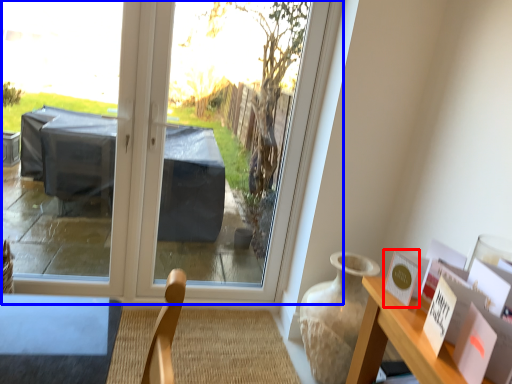
Question: Which point is further to the camera, postcard (highlighted by a red box) or window (highlighted by a blue box)?

Choices:
 (A) postcard
 (B) window

Answer: (B)